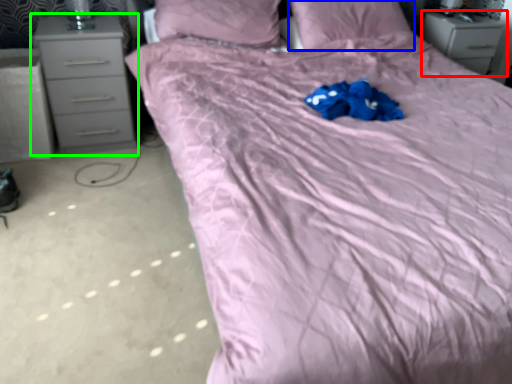
Question: Which object is positioned closest to chest of drawers (highlighted by a red box)? Select from pillow (highlighted by a blue box) and chest of drawers (highlighted by a green box).

Choices:
 (A) pillow
 (B) chest of drawers

Answer: (A)